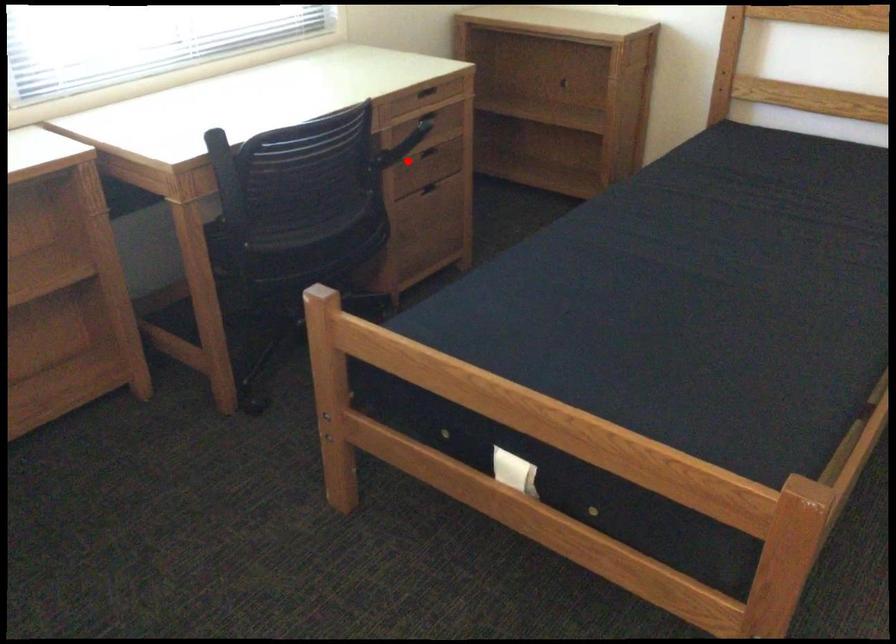
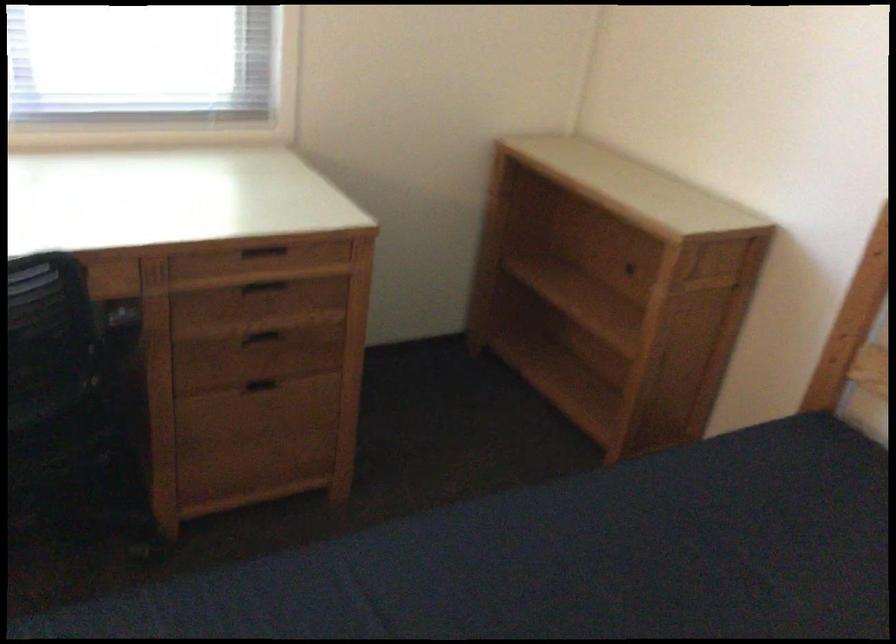
Question: I am providing you with two images of the same scene from different viewpoints. In image1, a red point is highlighted. Considering the same 3D point in image2, which of the following is correct?

Choices:
 (A) It is closer
 (B) It is farther

Answer: (A)